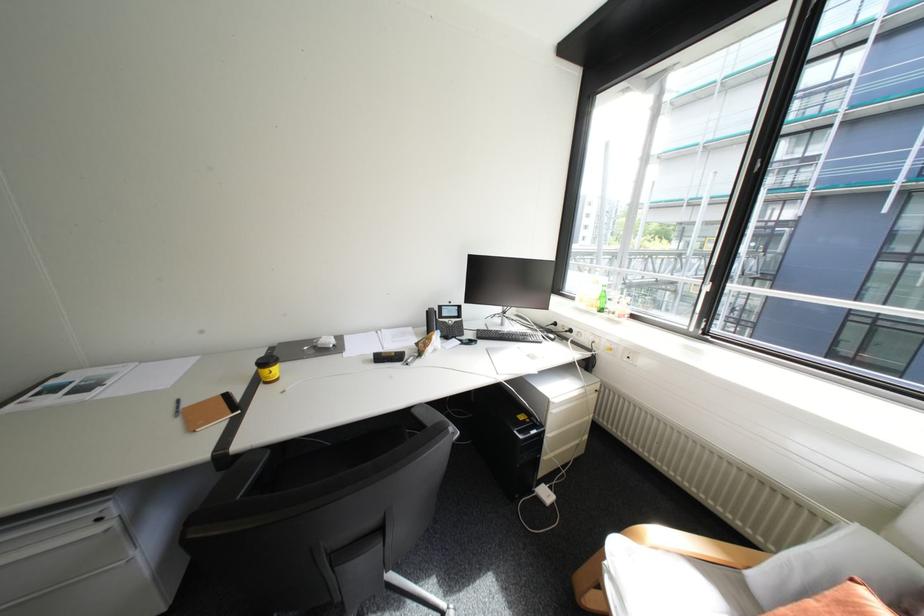
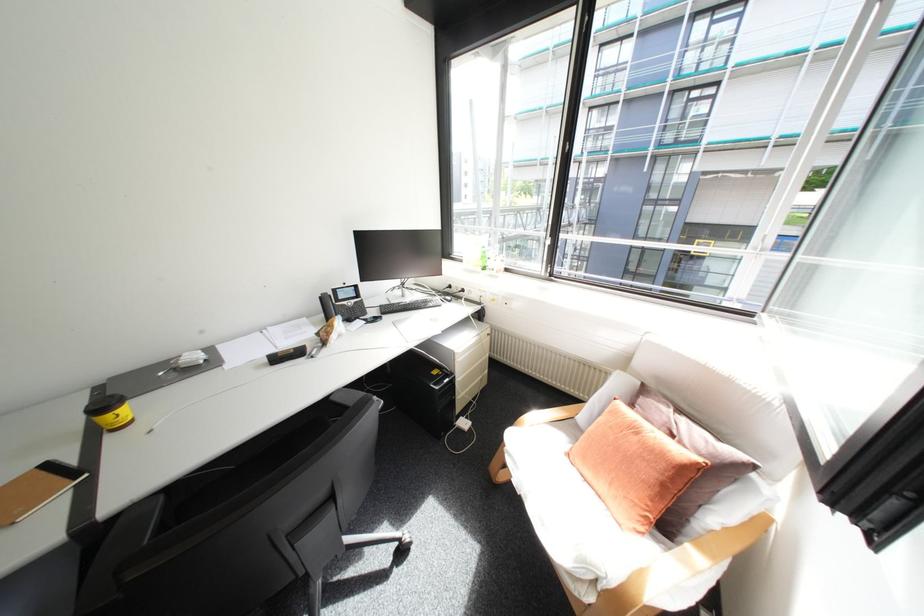
Where in the second image is the point corresponding to (382,358) from the first image?

(275, 361)